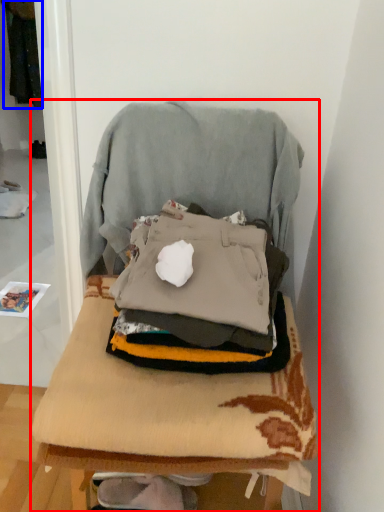
Question: Which object appears farthest to the camera in this image, furniture (highlighted by a red box) or clothing (highlighted by a blue box)?

Choices:
 (A) furniture
 (B) clothing

Answer: (B)